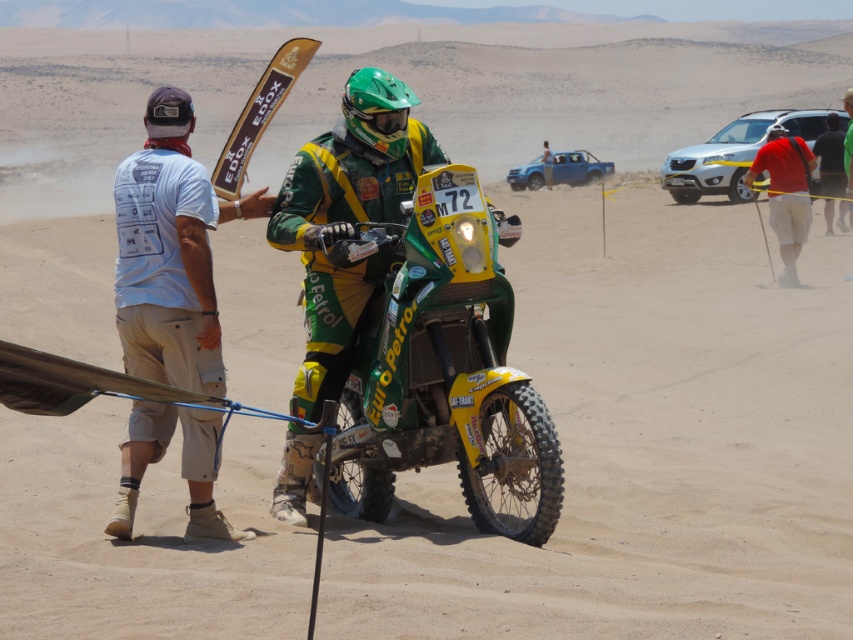
You are a photographer at the desert rally event. You need to capture a photo that includes both the white cotton shirt at left and the silver metallic suv at right. Based on their positions, which object should be placed on the left side of the photo to ensure both are visible?

The white cotton shirt at left should be placed on the left side of the photo since it is positioned on the left side of the silver metallic suv at right, ensuring both are visible in the frame.

You are a photographer positioned at the camera location. You want to take a photo focusing on the two points marked in the image. Which point, point 1 at coordinates (219,416) or point 2 at coordinates (808,166), will appear larger in your photo?

Point 1 at coordinates (219,416) is closer to the camera than point 2 at coordinates (808,166), so it will appear larger in the photo.

You are a drone operator tasked with capturing aerial footage of the green matte motorcycle at center. The drone must hover exactly above the motorcycle to get the best shot. What are the coordinates where the drone should position itself?

The drone should position itself at coordinates point [445,374] to hover exactly above the green matte motorcycle at center.